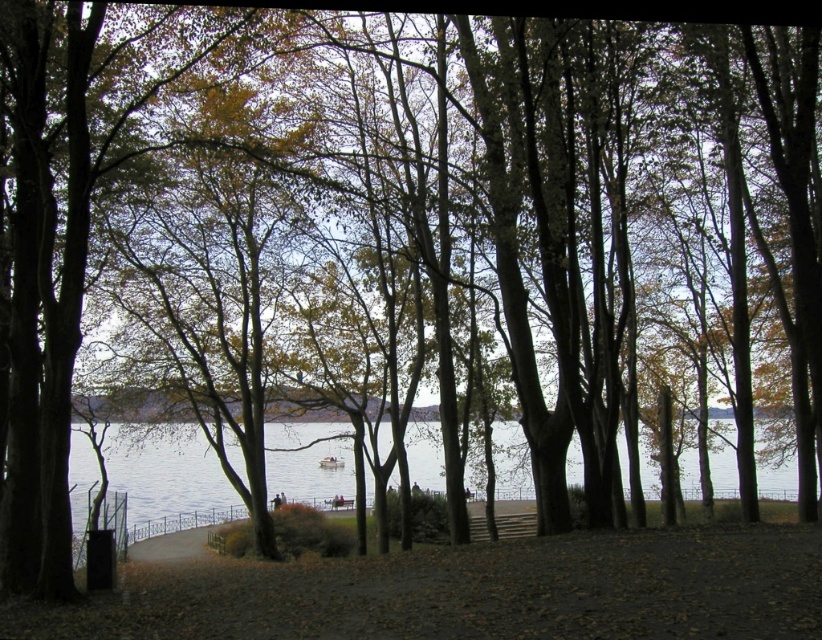
Question: Can you confirm if clear water at center is positioned below white plastic boat at center?

Choices:
 (A) no
 (B) yes

Answer: (A)

Question: Can you confirm if clear water at center is wider than white plastic boat at center?

Choices:
 (A) yes
 (B) no

Answer: (A)

Question: Does clear water at center come in front of white plastic boat at center?

Choices:
 (A) yes
 (B) no

Answer: (A)

Question: Which of the following is the closest to the observer?

Choices:
 (A) (183, 483)
 (B) (333, 464)

Answer: (B)

Question: Which object is farther from the camera taking this photo?

Choices:
 (A) white plastic boat at center
 (B) clear water at center

Answer: (A)

Question: Which point is closer to the camera taking this photo?

Choices:
 (A) (321, 460)
 (B) (418, 456)

Answer: (B)